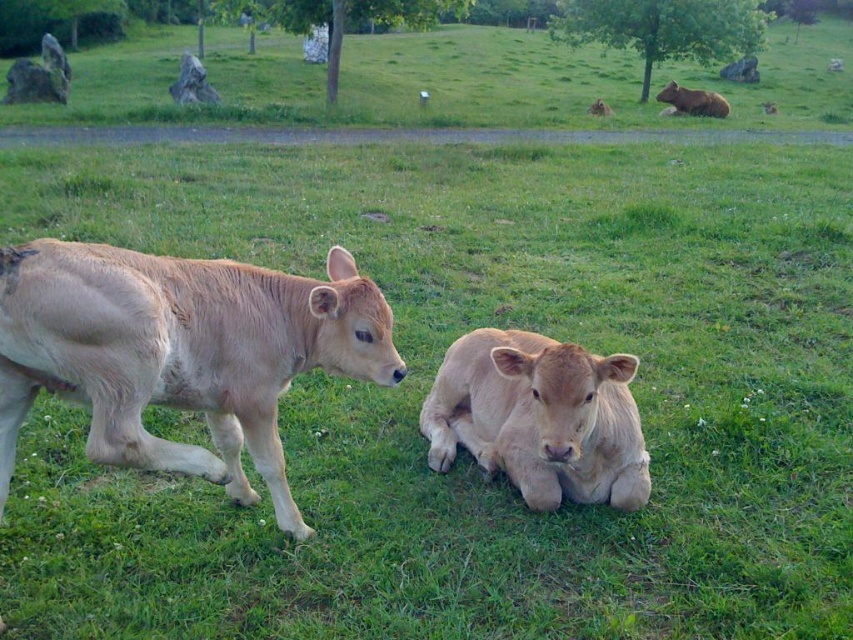
You are a photographer trying to capture a photo of both the light brown fur at left and the brown furry bear at upper right in the same frame. Based on their positions, which direction should you move your camera to include both subjects?

To include both the light brown fur at left and the brown furry bear at upper right in the same frame, you should move your camera to the left since the light brown fur at left is positioned to the left of the brown furry bear at upper right.

You are a photographer trying to capture the light brown fur at center. You have a camera with a zoom lens that can focus on a specific point. The point you need to focus on is point [538,417]. Is this point located on the light brown fur at center?

Yes, the point [538,417] is on the light brown fur at center according to the description.

You are a photographer standing at the camera position. You want to take a closeup photo of the light brown fur at center. Can you reach the calf without stepping further than 3 meters from your current position?

The distance between the light brown fur at center and the camera is 2.80 meters, so yes, you can reach the calf without exceeding the 3 meter limit.